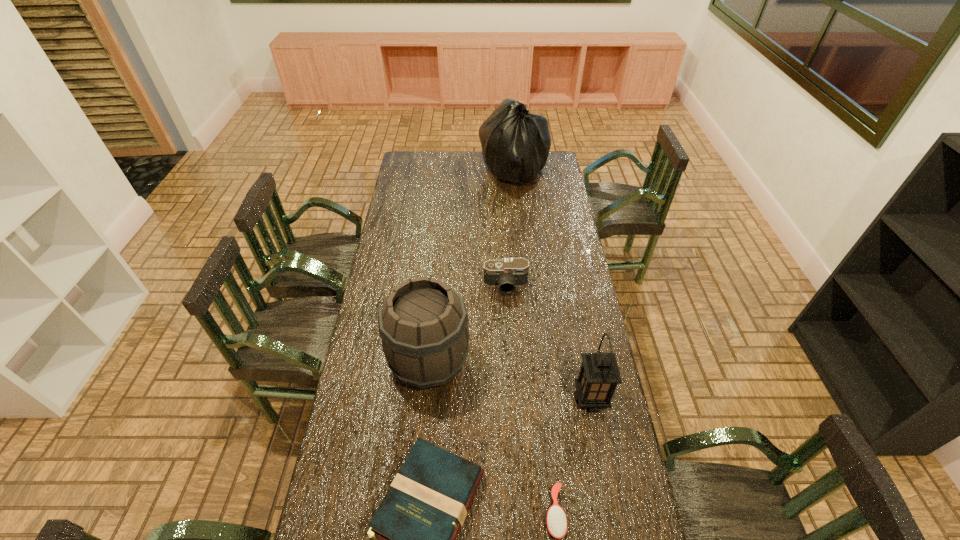
I want to click on object that is at the far edge, so click(x=515, y=143).

At what (x,y) coordinates should I click in order to perform the action: click on object that is at the left edge. Please return your answer as a coordinate pair (x, y). The image size is (960, 540). Looking at the image, I should click on (423, 324).

The height and width of the screenshot is (540, 960). What are the coordinates of `plastic bag situated at the right edge` in the screenshot? It's located at (515, 143).

Locate an element on the screen. The height and width of the screenshot is (540, 960). lantern that is positioned at the right edge is located at coordinates (599, 374).

I want to click on object positioned at the far right corner, so click(515, 143).

The width and height of the screenshot is (960, 540). In order to click on vacant space at the left edge in this screenshot , I will do `click(359, 352)`.

Find the location of a particular element. The width and height of the screenshot is (960, 540). vacant space at the right edge of the desktop is located at coordinates (584, 518).

Locate an element on the screen. blank space at the far left corner is located at coordinates (420, 173).

Where is `empty location between the lantern and the wine bucket`? empty location between the lantern and the wine bucket is located at coordinates (510, 381).

Where is `vacant area between the wine bucket and the lantern`? This screenshot has height=540, width=960. vacant area between the wine bucket and the lantern is located at coordinates (x=510, y=381).